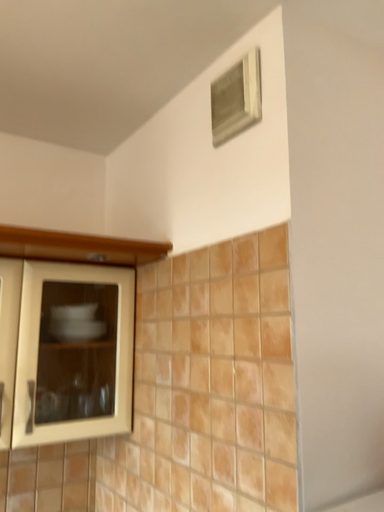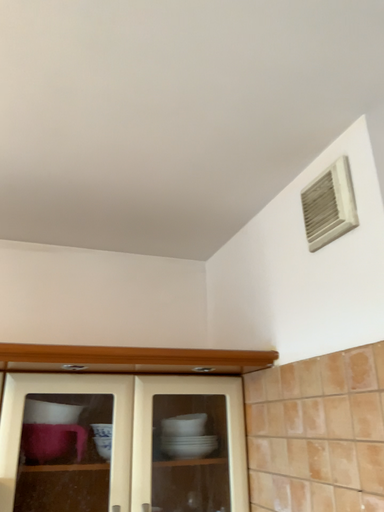
Question: Which way did the camera rotate in the video?

Choices:
 (A) rotated left
 (B) rotated right

Answer: (A)